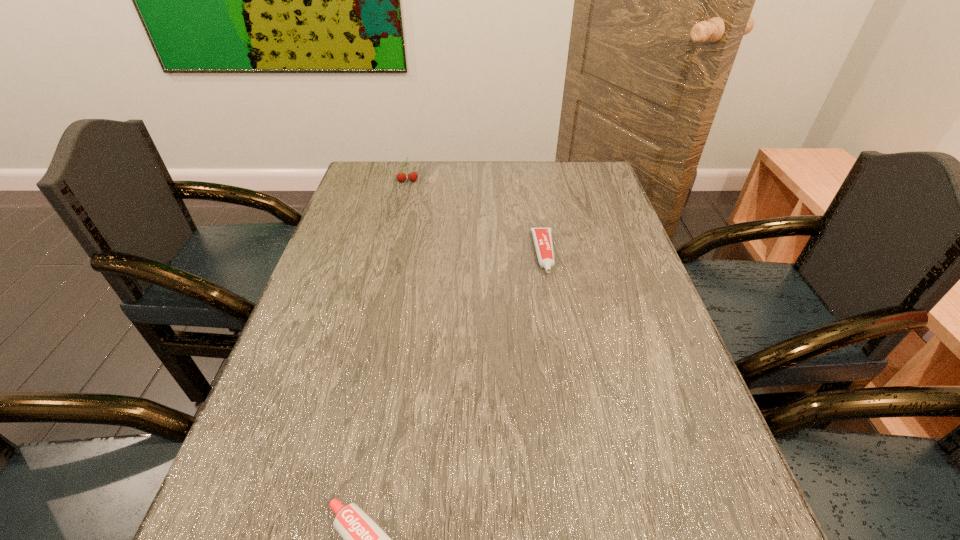
The image size is (960, 540). Find the location of `cherry`. cherry is located at coordinates (401, 177).

You are a GUI agent. You are given a task and a screenshot of the screen. Output one action in this format:
    pyautogui.click(x=<x>, y=<y>)
    Task: Click on the tallest object
    Image resolution: width=960 pixels, height=540 pixels.
    Given the screenshot: What is the action you would take?
    [x=401, y=177]

At what (x,y) coordinates should I click in order to perform the action: click on the right toothpaste. Please return your answer as a coordinate pair (x, y). Looking at the image, I should click on (542, 237).

Locate an element on the screen. This screenshot has width=960, height=540. the rightmost object is located at coordinates (542, 237).

Find the location of `free space located 0.240m on the surface of the farthest object`. free space located 0.240m on the surface of the farthest object is located at coordinates (396, 227).

The height and width of the screenshot is (540, 960). I want to click on free space located at the nozzle of the second farthest object, so click(550, 290).

Find the location of a particular element. The width and height of the screenshot is (960, 540). object at the far edge is located at coordinates (401, 177).

Locate an element on the screen. object that is at the left edge is located at coordinates (401, 177).

Locate an element on the screen. object at the far left corner is located at coordinates (401, 177).

Where is `vacant area at the far edge of the desktop`? The image size is (960, 540). vacant area at the far edge of the desktop is located at coordinates (500, 190).